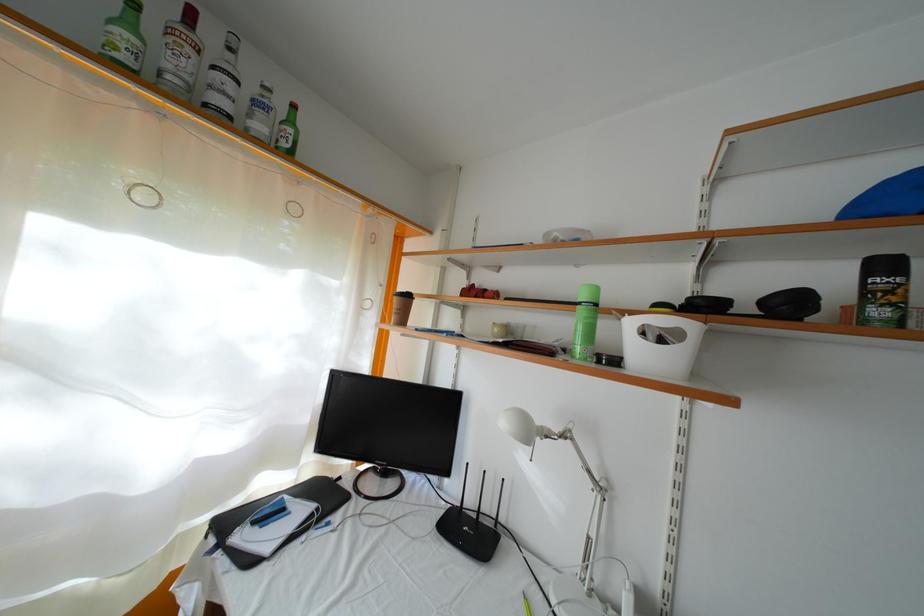
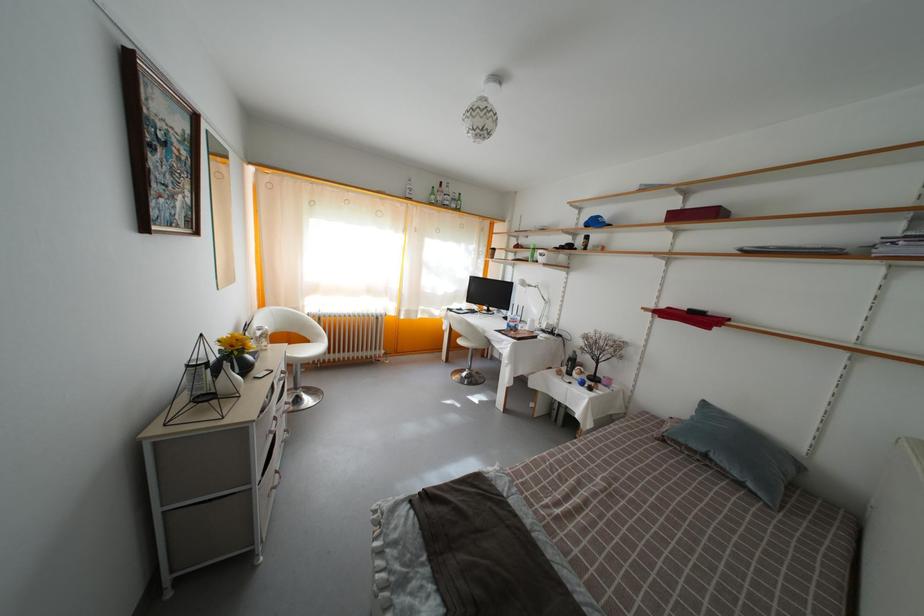
Where in the second image is the point corresponding to point 544,429 from the first image?

(533, 289)